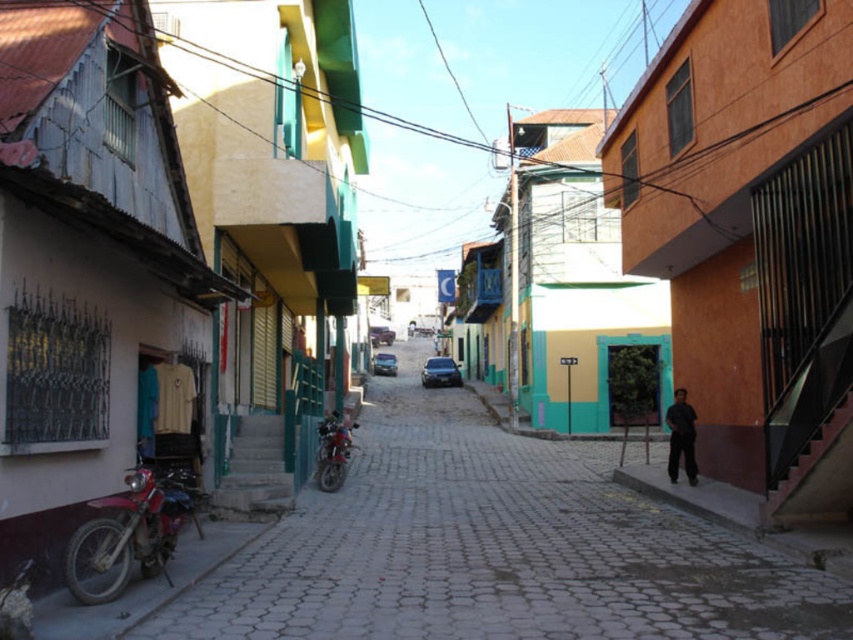
Question: Is red matte motorcycle at lower left below metallic red motorcycle at center?

Choices:
 (A) yes
 (B) no

Answer: (B)

Question: Which object is positioned closest to the metallic red motorcycle at center?

Choices:
 (A) dark gray fabric pants at lower right
 (B) red matte motorcycle at lower left
 (C) smooth concrete street at center

Answer: (C)

Question: Which object is the closest to the dark gray fabric pants at lower right?

Choices:
 (A) smooth concrete street at center
 (B) metallic red motorcycle at center
 (C) red matte motorcycle at lower left

Answer: (A)

Question: Can you confirm if red matte motorcycle at lower left is positioned to the left of dark gray fabric pants at lower right?

Choices:
 (A) no
 (B) yes

Answer: (B)

Question: Which point is farther from the camera taking this photo?

Choices:
 (A) (595, 563)
 (B) (669, 436)

Answer: (B)

Question: Can you confirm if red matte motorcycle at lower left is positioned below metallic red motorcycle at center?

Choices:
 (A) no
 (B) yes

Answer: (A)